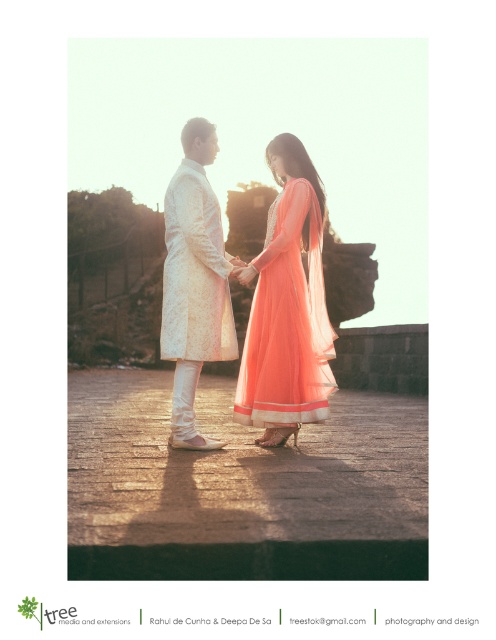
Can you confirm if matte peach gown at center is taller than white textured sherwani at center?

Incorrect, matte peach gown at center's height is not larger of white textured sherwani at center's.

What do you see at coordinates (287, 321) in the screenshot? I see `matte peach gown at center` at bounding box center [287, 321].

Identify the location of matte peach gown at center. (287, 321).

Which is more to the right, matte white sherwani at center or matte peach gown at center?

matte peach gown at center

Which is in front, point (213, 301) or point (257, 323)?

Point (213, 301) is more forward.

Between point (287, 160) and point (267, 276), which one is positioned in front?

Point (267, 276) is more forward.

Locate an element on the screen. This screenshot has width=496, height=640. matte white sherwani at center is located at coordinates (239, 282).

Does matte white sherwani at center appear under white textured sherwani at center?

Yes.

Is matte white sherwani at center taller than white textured sherwani at center?

Indeed, matte white sherwani at center has a greater height compared to white textured sherwani at center.

Image resolution: width=496 pixels, height=640 pixels. What are the coordinates of `matte white sherwani at center` in the screenshot? It's located at (239, 282).

I want to click on matte white sherwani at center, so click(x=239, y=282).